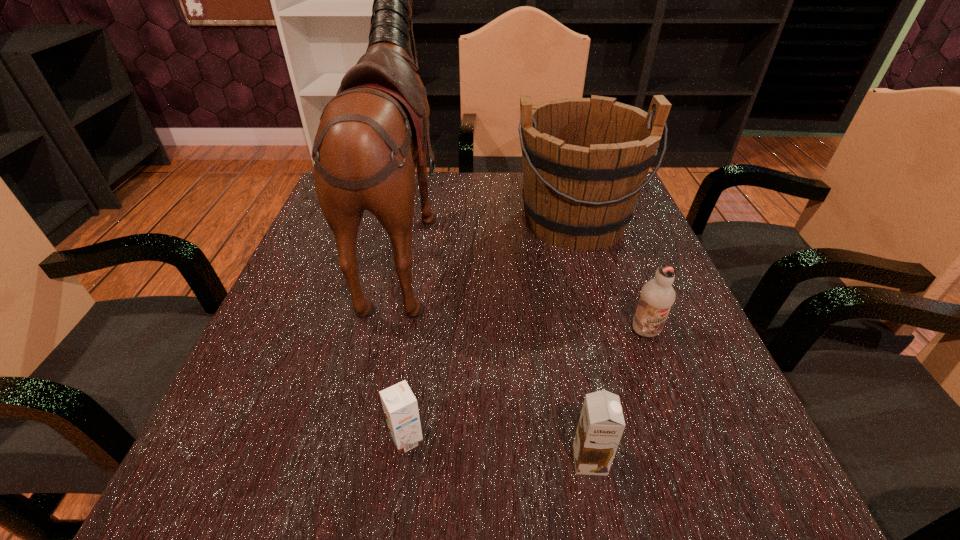
You are a GUI agent. You are given a task and a screenshot of the screen. Output one action in this format:
    pyautogui.click(x=<x>, y=<y>)
    Task: Click on the free space in the image that satisfies the following two spatial constraints: 1. on the front side of the second chocolate milk from right to left; 2. on the right side of the shortest chocolate milk
    This screenshot has height=540, width=960.
    Given the screenshot: What is the action you would take?
    tap(403, 460)

Find the location of a particular element. This screenshot has height=540, width=960. vacant space that satisfies the following two spatial constraints: 1. on the front side of the second chocolate milk from right to left; 2. on the left side of the shortest object is located at coordinates (403, 460).

Identify the location of free spot that satisfies the following two spatial constraints: 1. on the side of the second tallest object with the handle for carrying; 2. on the left side of the rightmost chocolate milk. (608, 332).

You are a GUI agent. You are given a task and a screenshot of the screen. Output one action in this format:
    pyautogui.click(x=<x>, y=<y>)
    Task: Click on the vacant space that satisfies the following two spatial constraints: 1. on the back of the tallest object; 2. on the right side of the shortest chocolate milk
    Image resolution: width=960 pixels, height=540 pixels.
    Given the screenshot: What is the action you would take?
    pyautogui.click(x=363, y=439)

The image size is (960, 540). What are the coordinates of `free region that satisfies the following two spatial constraints: 1. on the side of the second tallest object with the handle for carrying; 2. on the back of the saddle` in the screenshot? It's located at (581, 239).

In order to click on free space in the image that satisfies the following two spatial constraints: 1. on the back of the saddle; 2. on the left side of the leftmost chocolate milk in this screenshot , I will do `click(363, 439)`.